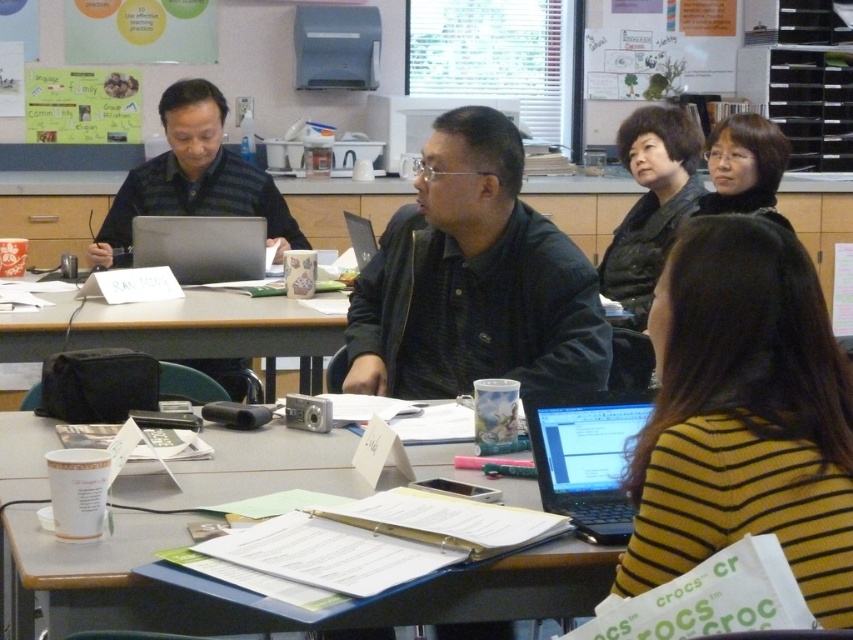
Question: Where is black matte shirt at center located in relation to black plastic laptop at lower right in the image?

Choices:
 (A) above
 (B) below

Answer: (A)

Question: Among these objects, which one is farthest from the camera?

Choices:
 (A) black matte shirt at center
 (B) wooden table at center
 (C) matte black shirt at center

Answer: (C)

Question: Which of the following is the farthest from the observer?

Choices:
 (A) black matte shirt at center
 (B) matte black shirt at center

Answer: (B)

Question: Among these objects, which one is nearest to the camera?

Choices:
 (A) matte plastic folder at center
 (B) wooden table at center
 (C) yellow striped sweater at lower right
 (D) matte black shirt at center

Answer: (C)

Question: Is yellow striped sweater at lower right closer to camera compared to wooden table at center?

Choices:
 (A) no
 (B) yes

Answer: (B)

Question: Is yellow striped sweater at lower right thinner than matte black shirt at center?

Choices:
 (A) no
 (B) yes

Answer: (B)